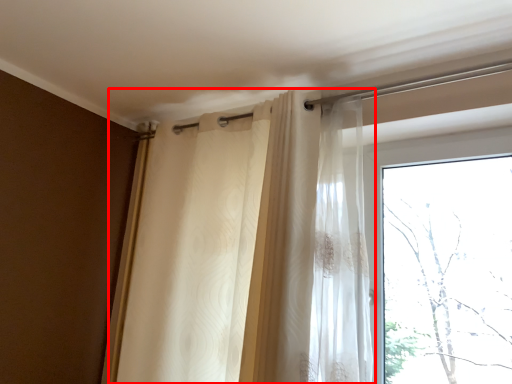
Question: In this image, where is curtain (annotated by the red box) located relative to window?

Choices:
 (A) right
 (B) left

Answer: (B)